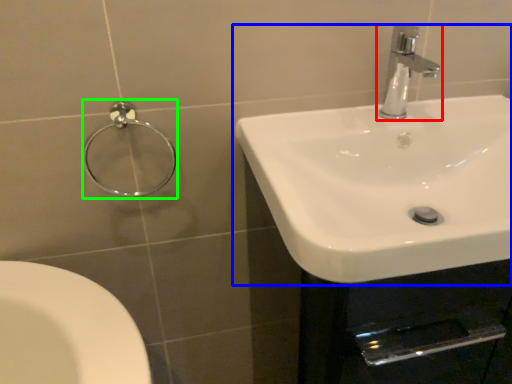
Question: Which object is the farthest from tap (highlighted by a red box)? Choose among these: sink (highlighted by a blue box) or shower (highlighted by a green box).

Choices:
 (A) sink
 (B) shower

Answer: (B)